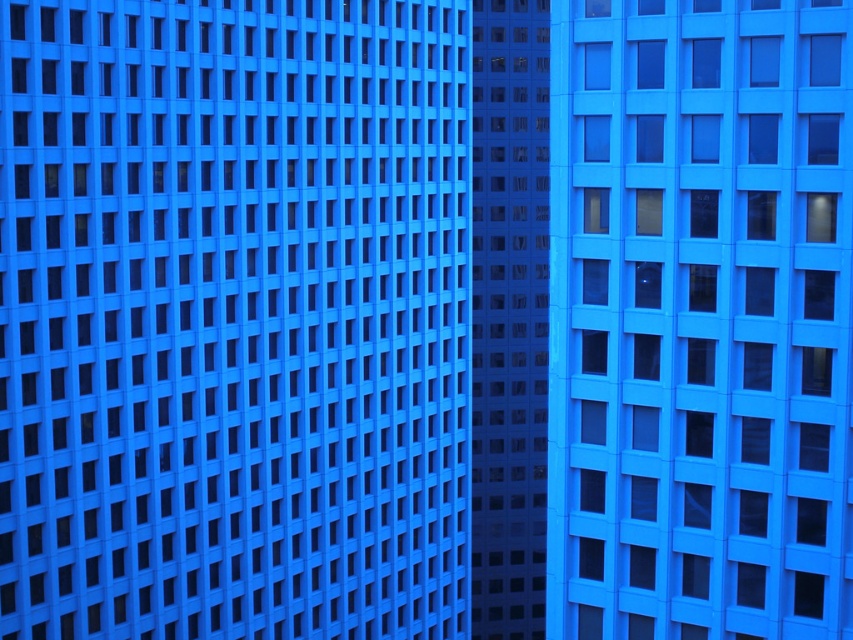
Consider the image. You are a window installer who needs to replace the matte glass windows at right. The new windows must be spaced exactly 25 meters apart. Will the current spacing between them allow for this replacement?

The matte glass windows at right are currently 25.41 meters apart, which is slightly more than the required 25 meters. The spacing is sufficient for the replacement.

You are standing in front of two adjacent buildings. You see a point at coordinates point (700, 320). Which building does this point belong to?

The point (700, 320) lies at matte glass windows at right, so it belongs to the right building.